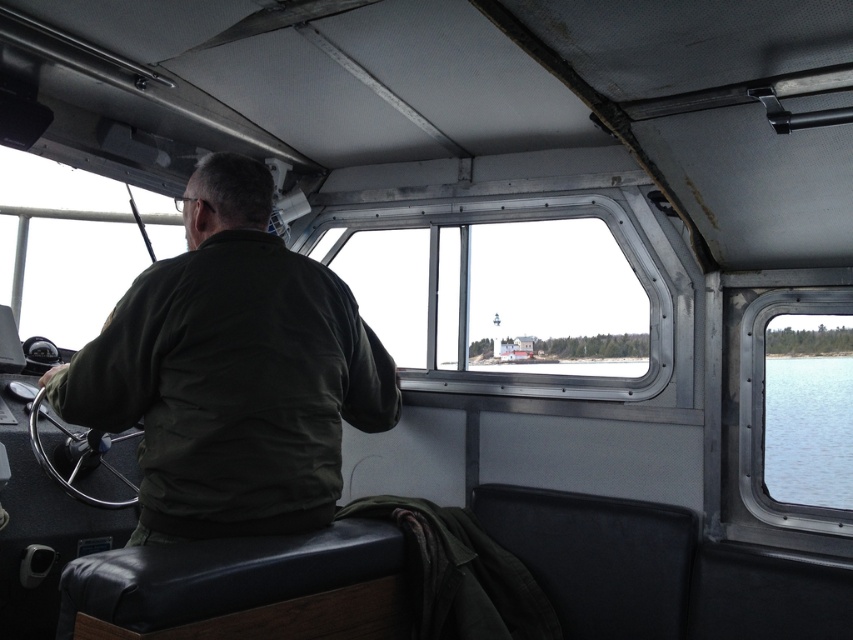
Does point (764, 397) come closer to viewer compared to point (838, 307)?

No, (764, 397) is further to viewer.

Where is `transparent water at lower right`? The width and height of the screenshot is (853, 640). transparent water at lower right is located at coordinates (808, 429).

Between clear glass window at center and transparent water at lower right, which one appears on the left side from the viewer's perspective?

Positioned to the left is clear glass window at center.

Find the location of a particular element. clear glass window at center is located at coordinates (508, 292).

Who is more forward, (650, 392) or (816, 376)?

Positioned in front is point (816, 376).

Where is `clear glass window at center`? The width and height of the screenshot is (853, 640). clear glass window at center is located at coordinates click(508, 292).

How far apart are dark green fabric at center and clear glass window at center?

dark green fabric at center and clear glass window at center are 1.28 meters apart from each other.

Who is more forward, (277,349) or (525,333)?

Point (277,349) is in front.

The image size is (853, 640). I want to click on dark green fabric at center, so click(x=231, y=371).